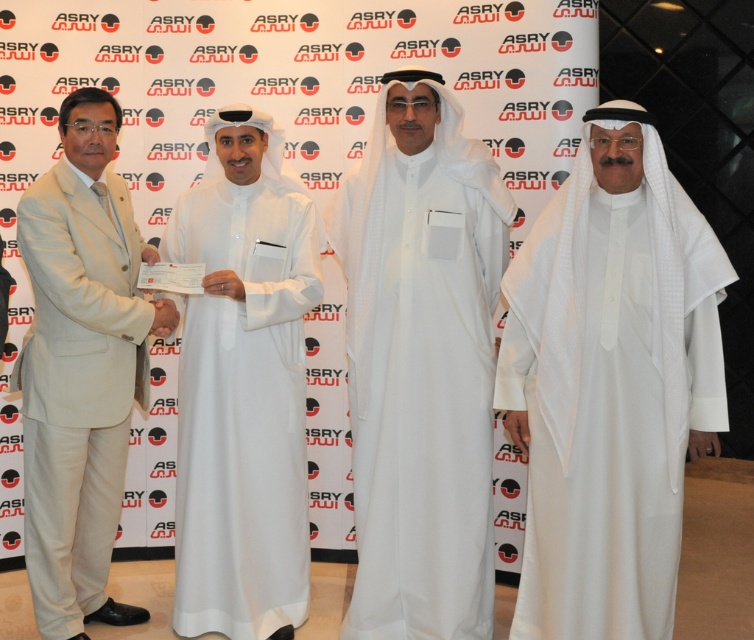
Question: Which object is positioned closest to the beige suit at left?

Choices:
 (A) white textured thobe at center
 (B) white cotton thobe at center

Answer: (B)

Question: Which of these objects is positioned closest to the white cotton thobe at center?

Choices:
 (A) white textured thobe at center
 (B) white matte abaya at center
 (C) beige suit at left

Answer: (A)

Question: Is white cotton thobe at center positioned at the back of beige suit at left?

Choices:
 (A) yes
 (B) no

Answer: (A)

Question: Does white textured thobe at center lie in front of white cotton thobe at center?

Choices:
 (A) no
 (B) yes

Answer: (B)

Question: Does white textured thobe at center lie behind white matte abaya at center?

Choices:
 (A) no
 (B) yes

Answer: (A)

Question: Estimate the real-world distances between objects in this image. Which object is closer to the white textured thobe at center?

Choices:
 (A) white matte abaya at center
 (B) beige suit at left

Answer: (A)